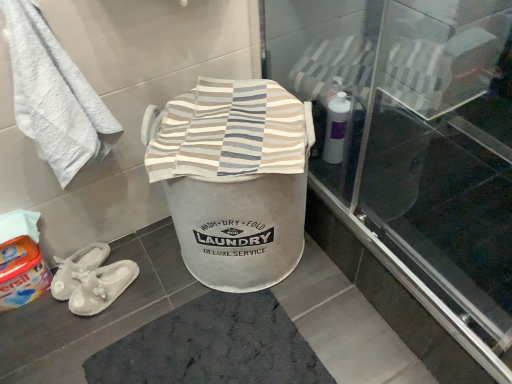
The width and height of the screenshot is (512, 384). Find the location of `vacant area that lies between white fabric slippers at lower left and white fabric laundry basket at center`. vacant area that lies between white fabric slippers at lower left and white fabric laundry basket at center is located at coordinates (154, 276).